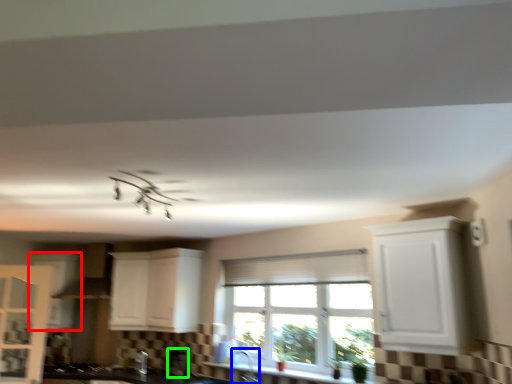
Question: Which object is positioned farthest from cabinetry (highlighted by a red box)? Select from faucet (highlighted by a blue box) and appliance (highlighted by a green box).

Choices:
 (A) faucet
 (B) appliance

Answer: (A)